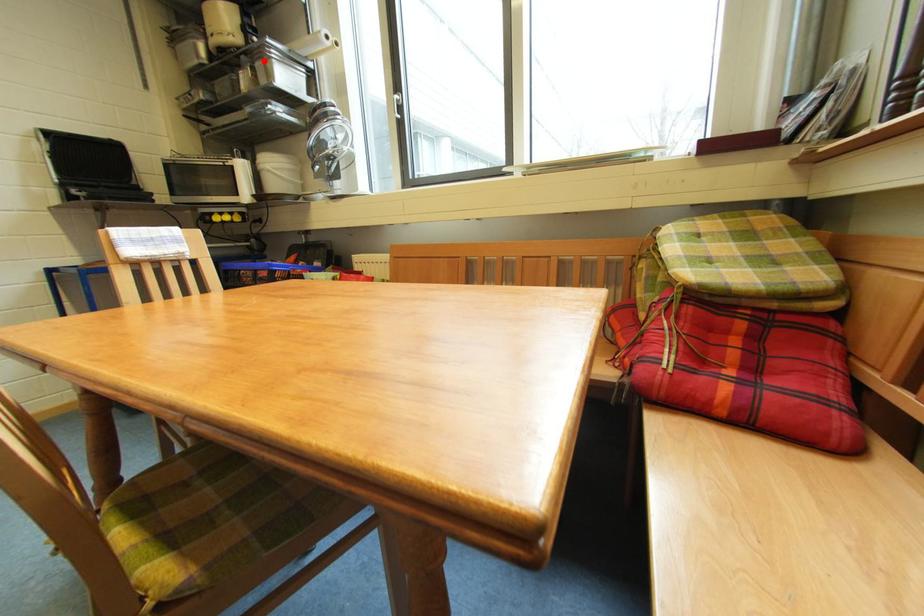
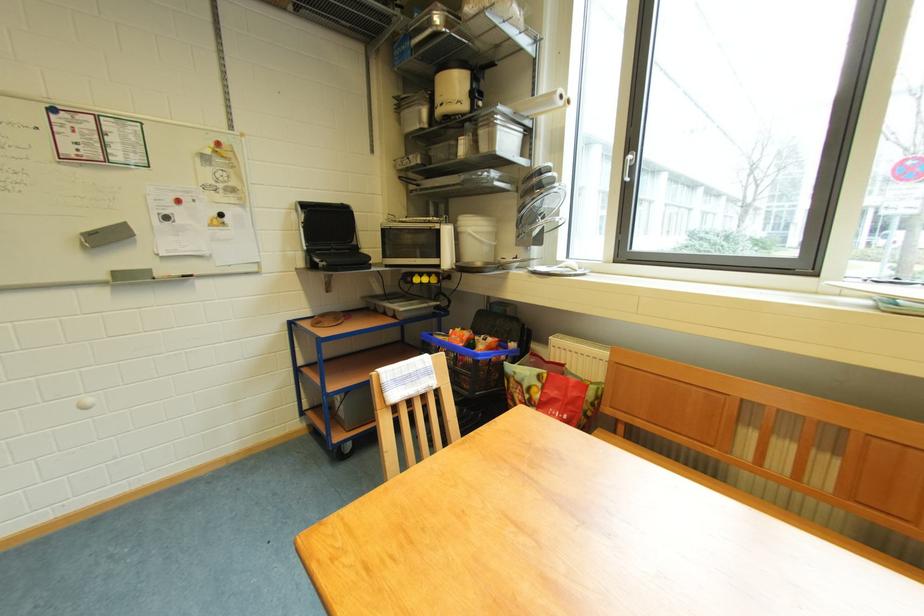
In the second image, find the point that corresponds to the highlighted location in the first image.

(488, 127)